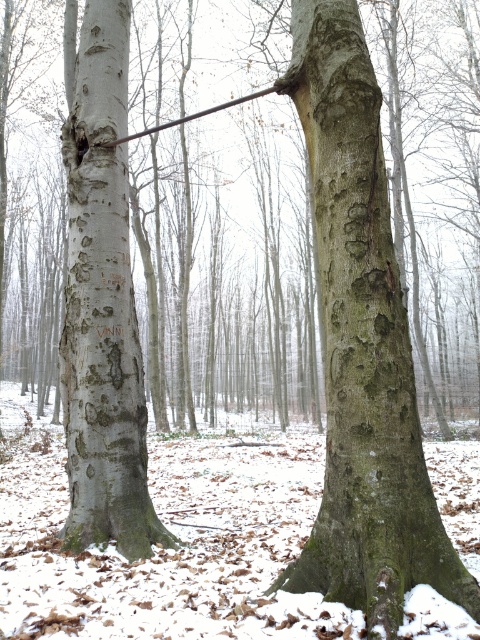
You are a hiker who wants to take a photo of the green rough bark tree trunk at center. You are currently standing at point (361, 346). Is the green rough bark tree trunk at center in your immediate vicinity?

Yes, the green rough bark tree trunk at center is located exactly at point (361, 346), so it is in your immediate vicinity.

You are a hiker standing in the winter forest scene. You notice the green rough bark tree trunk at center and the smooth gray bark at left. Which tree trunk is nearer to you?

The green rough bark tree trunk at center is closer to the viewer than the smooth gray bark at left, so the green rough bark tree trunk at center is nearer to you.

Looking at this image, you are an observer standing in the winter forest scene. You notice the green rough bark tree trunk at center and the smooth gray bark at left. Which tree trunk is closer to the ground?

The green rough bark tree trunk at center is positioned under smooth gray bark at left, so it is closer to the ground.